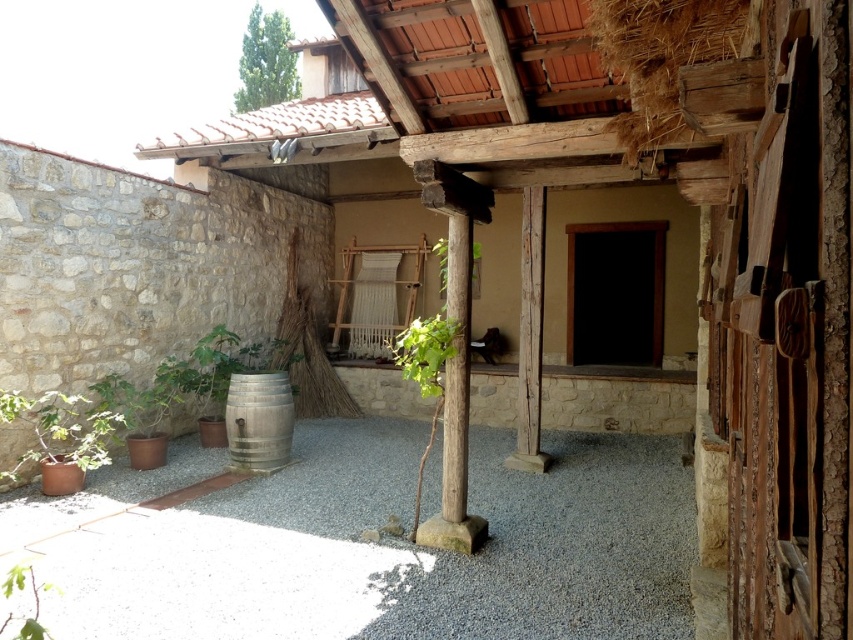
You are standing in the courtyard and need to place a small potted plant exactly at the gray gravel at lower center. According to the coordinates provided, where should you place the plant?

The gray gravel at lower center is located at point (366, 545), so you should place the small potted plant at those coordinates.

You are planning to place a bench between the green leafy plant at center and the green leafy plant at lower left. The bench requires 8 feet of space. Is there enough space between them to fit the bench?

The distance between the green leafy plant at center and the green leafy plant at lower left is 7.43 feet. Since the bench requires 8 feet of space, there is not enough space to fit the bench between them.